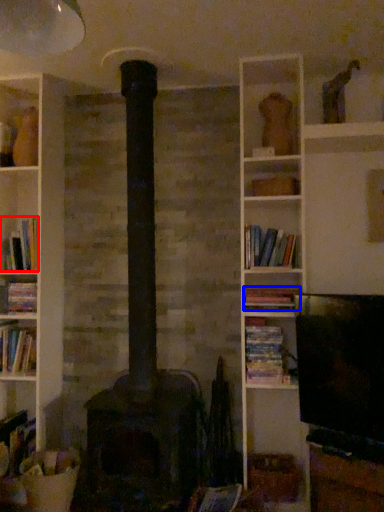
Question: Which object appears closest to the camera in this image, book (highlighted by a red box) or book (highlighted by a blue box)?

Choices:
 (A) book
 (B) book

Answer: (B)